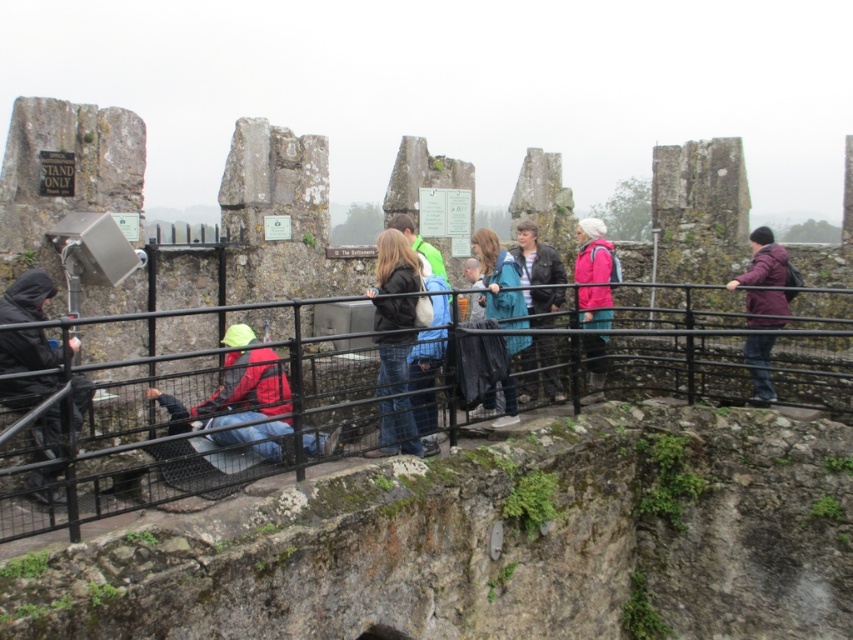
You are standing at the center of the historical site and want to locate the denim jacket at center. According to the coordinates provided, where exactly should you look to find it?

The denim jacket at center is located at the 2D coordinates point (x=393, y=282).

Looking at this image, you are standing at the historical site and want to reach the stone wall with moss. The point you need to reach is marked as point (x=328, y=435). If your walking distance limit is 100 feet, will you be able to reach it?

The distance between point (x=328, y=435) and the viewer is 120.25 feet, which exceeds the walking limit of 100 feet. Therefore, you cannot reach it within the limit.